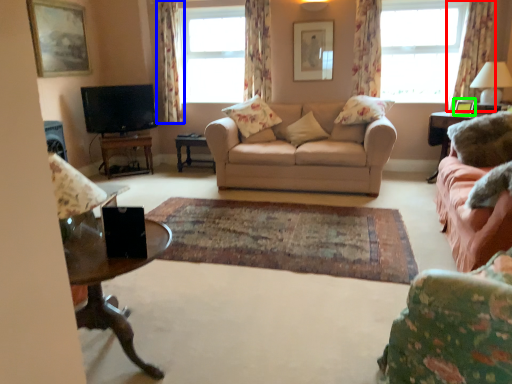
Question: Based on their relative distances, which object is farther from curtain (highlighted by a red box)? Choose from curtain (highlighted by a blue box) and picture frame (highlighted by a green box).

Choices:
 (A) curtain
 (B) picture frame

Answer: (A)